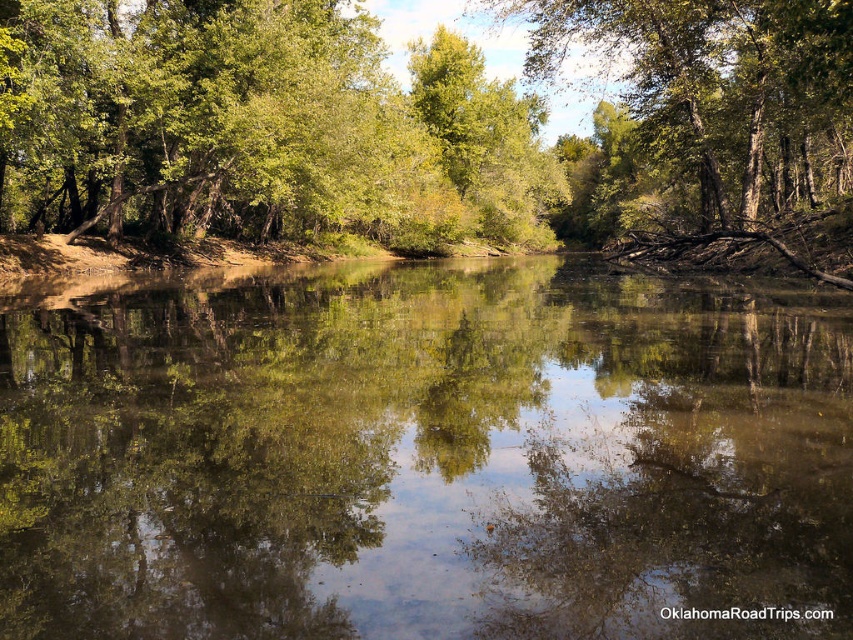
Between green leafy tree at center and green leafy tree at upper center, which one has more height?

With more height is green leafy tree at upper center.

Is green leafy tree at center closer to camera compared to green leafy tree at upper center?

A: Yes, green leafy tree at center is in front of green leafy tree at upper center.

You are a GUI agent. You are given a task and a screenshot of the screen. Output one action in this format:
    pyautogui.click(x=<x>, y=<y>)
    Task: Click on the green leafy tree at center
    This screenshot has width=853, height=640.
    Given the screenshot: What is the action you would take?
    coord(413,122)

Can you confirm if clear water at center is positioned to the right of green leafy tree at upper center?

In fact, clear water at center is to the left of green leafy tree at upper center.

Who is more distant from viewer, (334, 598) or (804, 193)?

The point (804, 193) is behind.

Find the location of a particular element. Image resolution: width=853 pixels, height=640 pixels. clear water at center is located at coordinates [x=422, y=452].

Find the location of a particular element. clear water at center is located at coordinates (422, 452).

Is point (485, 433) closer to viewer compared to point (827, 26)?

Yes, point (485, 433) is closer to viewer.

The height and width of the screenshot is (640, 853). Describe the element at coordinates (422, 452) in the screenshot. I see `clear water at center` at that location.

Locate an element on the screen. The image size is (853, 640). clear water at center is located at coordinates (422, 452).